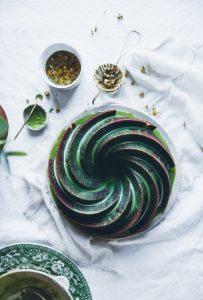
The width and height of the screenshot is (203, 300). In order to click on green plate in this screenshot , I will do `click(57, 260)`.